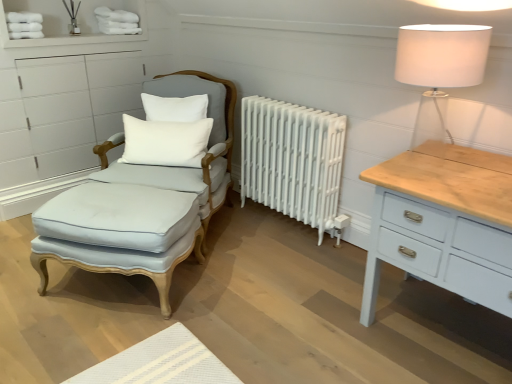
You are a GUI agent. You are given a task and a screenshot of the screen. Output one action in this format:
    pyautogui.click(x=<x>, y=<y>)
    Task: Click on the free spot in front of light blue fabric footrest at left
    This screenshot has width=512, height=384.
    Given the screenshot: What is the action you would take?
    (x=106, y=342)